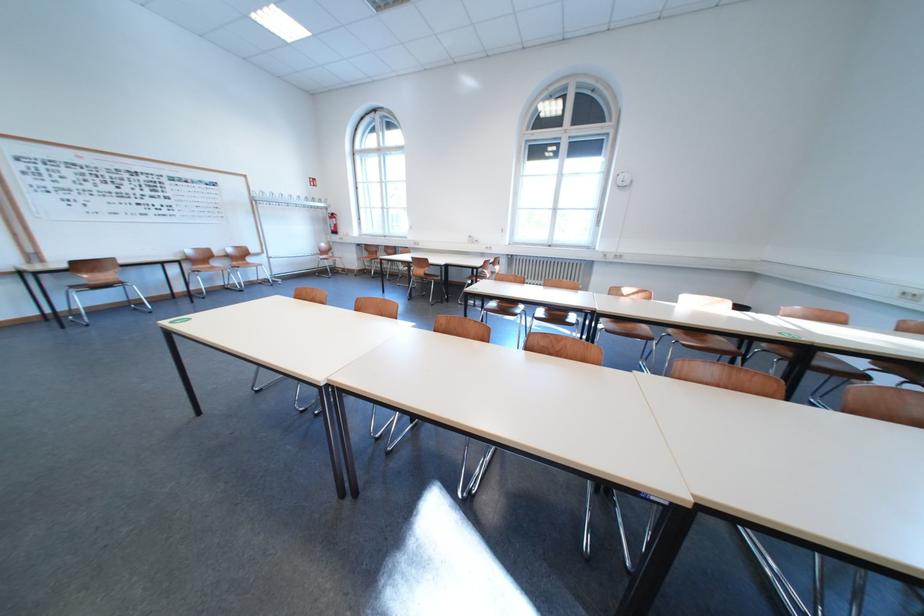
Where would you squeez the fire extinguisher lever? Please return your answer as a coordinate pair (x, y).

(333, 223)